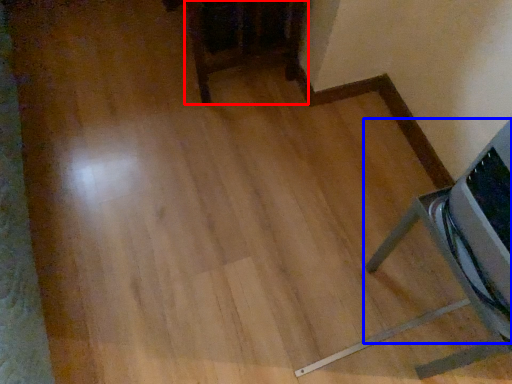
Question: Which of the following is the closest to the observer, furniture (highlighted by a red box) or furniture (highlighted by a blue box)?

Choices:
 (A) furniture
 (B) furniture

Answer: (B)